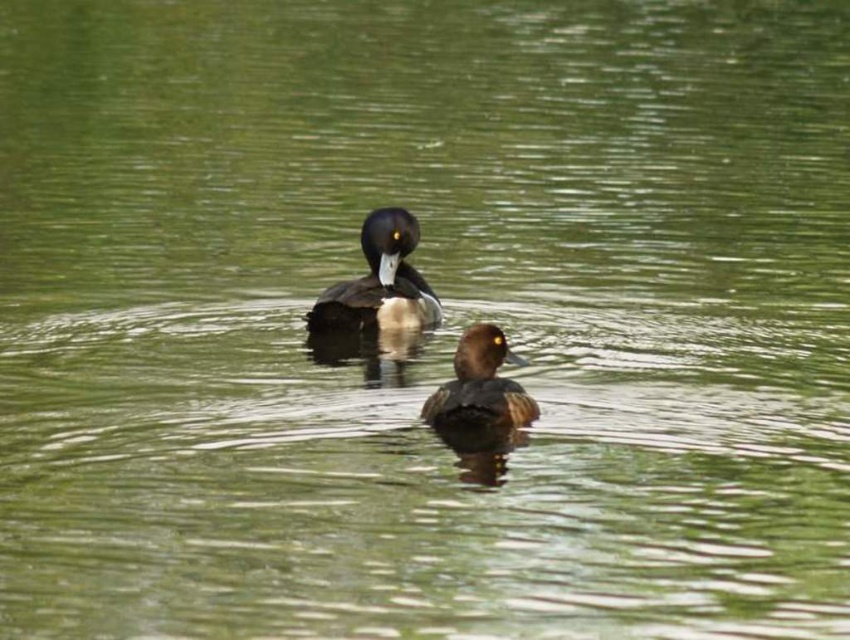
Question: Among these objects, which one is farthest from the camera?

Choices:
 (A) brown fuzzy duck at center
 (B) shiny black duck at center

Answer: (B)

Question: Does shiny black duck at center have a lesser width compared to brown fuzzy duck at center?

Choices:
 (A) no
 (B) yes

Answer: (A)

Question: Does shiny black duck at center appear on the left side of brown fuzzy duck at center?

Choices:
 (A) no
 (B) yes

Answer: (B)

Question: Which of the following is the closest to the observer?

Choices:
 (A) (316, 323)
 (B) (468, 352)

Answer: (B)

Question: Which point is closer to the camera?

Choices:
 (A) brown fuzzy duck at center
 (B) shiny black duck at center

Answer: (A)

Question: Where is shiny black duck at center located in relation to brown fuzzy duck at center in the image?

Choices:
 (A) below
 (B) above

Answer: (B)